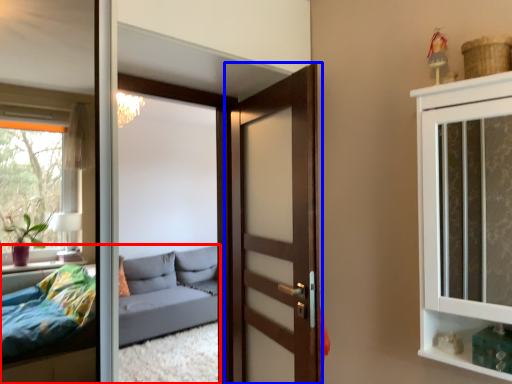
Question: Which point is further to the camera, studio couch (highlighted by a red box) or door (highlighted by a blue box)?

Choices:
 (A) studio couch
 (B) door

Answer: (A)